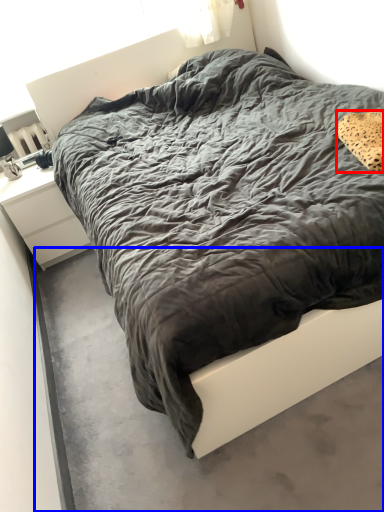
Question: Which object appears farthest to the camera in this image, pillow (highlighted by a red box) or concrete (highlighted by a blue box)?

Choices:
 (A) pillow
 (B) concrete

Answer: (A)